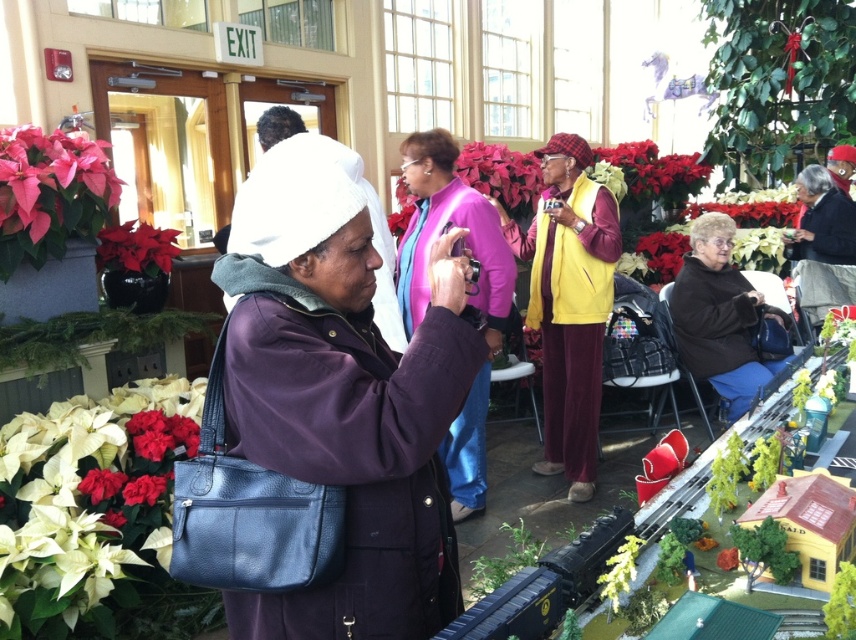
Who is positioned more to the left, poinsettia leaf at center or matte red flower at left?

Positioned to the left is matte red flower at left.

Does poinsettia leaf at center appear under matte red flower at left?

No, poinsettia leaf at center is not below matte red flower at left.

Does point (474, 172) lie behind point (98, 252)?

Yes, it is.

Where is `poinsettia leaf at center`? This screenshot has width=856, height=640. poinsettia leaf at center is located at coordinates (501, 173).

In the scene shown: Who is taller, purple fabric jacket at center or poinsettia leaf at center?

With more height is purple fabric jacket at center.

Is purple fabric jacket at center smaller than poinsettia leaf at center?

No, purple fabric jacket at center is not smaller than poinsettia leaf at center.

This screenshot has width=856, height=640. I want to click on purple fabric jacket at center, so click(x=467, y=300).

Between matte black purse at center and poinsettia leaf at center, which one is positioned lower?

matte black purse at center is lower down.

Does matte black purse at center appear on the left side of poinsettia leaf at center?

Yes, matte black purse at center is to the left of poinsettia leaf at center.

Measure the distance between matte black purse at center and camera.

matte black purse at center is 1.22 meters away from camera.

Find the location of a particular element. matte black purse at center is located at coordinates (343, 396).